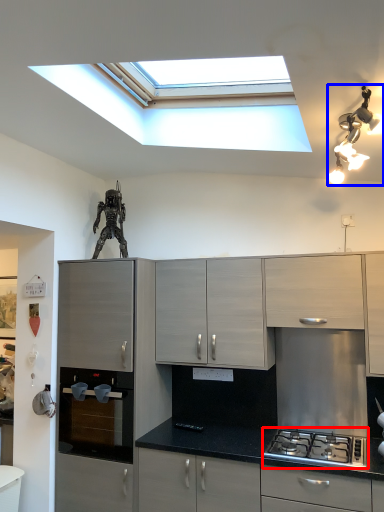
Question: Which of the following is the closest to the observer, gas stove (highlighted by a red box) or light fixture (highlighted by a blue box)?

Choices:
 (A) gas stove
 (B) light fixture

Answer: (B)